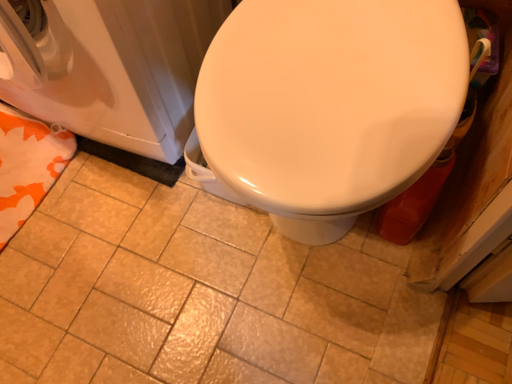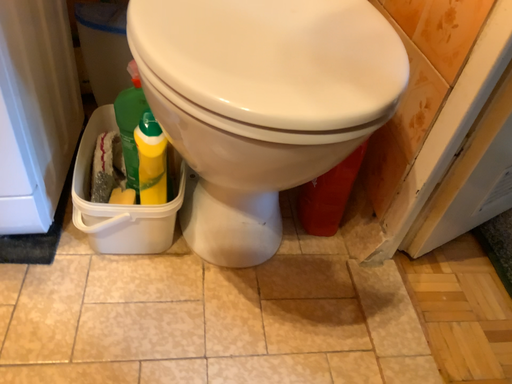
Question: Which way did the camera rotate in the video?

Choices:
 (A) rotated left
 (B) rotated right

Answer: (B)